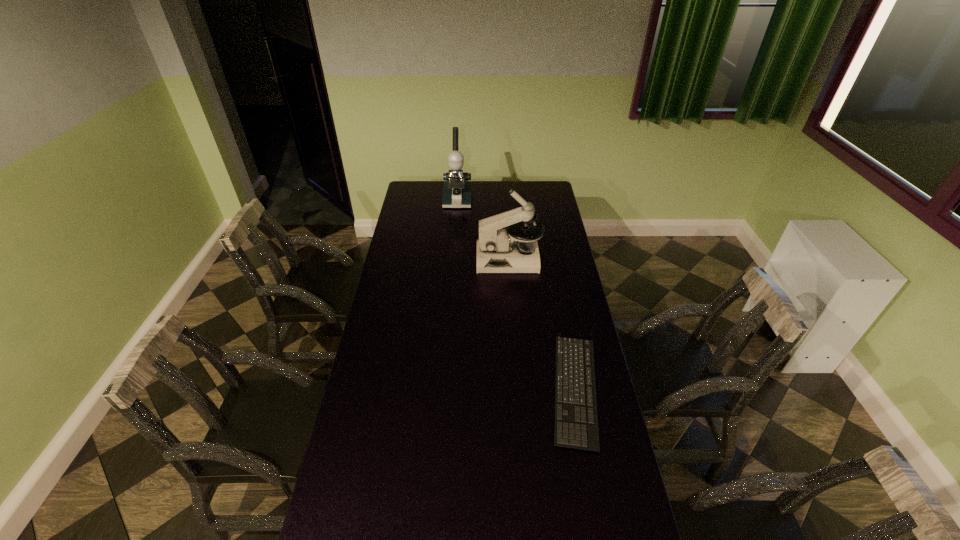
Select which object appears as the second closest to the shortest object. Please provide its 2D coordinates. Your answer should be formatted as a tuple, i.e. [(x, y)], where the tuple contains the x and y coordinates of a point satisfying the conditions above.

[(457, 189)]

Where is `free space that satisfies the following two spatial constraints: 1. on the back side of the computer keyboard; 2. at the eyepiece of the second farthest object`? free space that satisfies the following two spatial constraints: 1. on the back side of the computer keyboard; 2. at the eyepiece of the second farthest object is located at coordinates (550, 259).

You are a GUI agent. You are given a task and a screenshot of the screen. Output one action in this format:
    pyautogui.click(x=<x>, y=<y>)
    Task: Click on the vacant space that satisfies the following two spatial constraints: 1. at the eyepiece of the right microscope; 2. on the right side of the shortest object
    
    Given the screenshot: What is the action you would take?
    pyautogui.click(x=519, y=389)